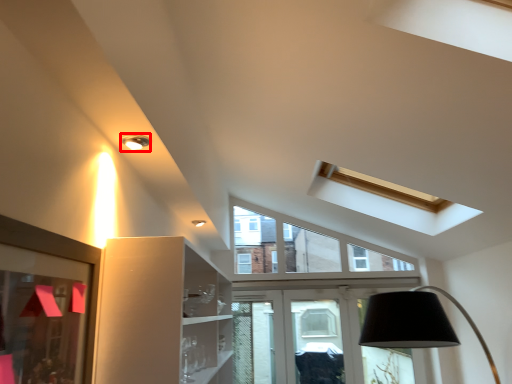
Question: From the image's perspective, where is light fixture (annotated by the red box) located relative to picture frame?

Choices:
 (A) below
 (B) above

Answer: (B)